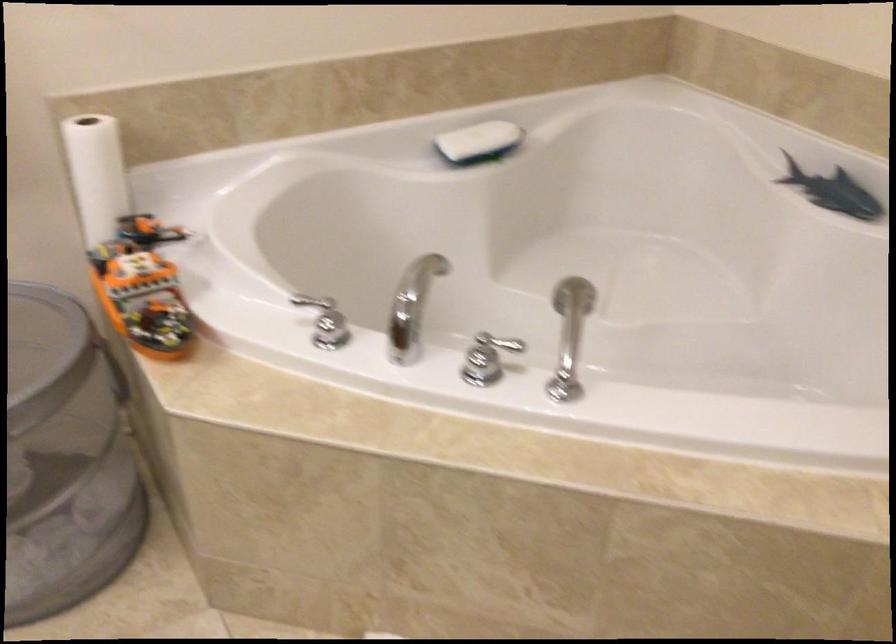
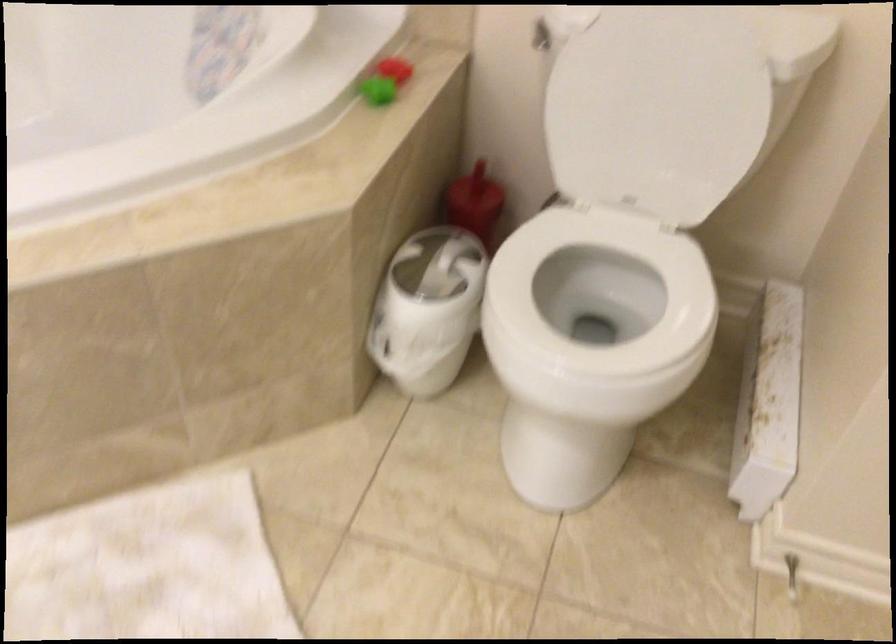
How did the camera likely rotate?

The rotation direction of the camera is right-down.